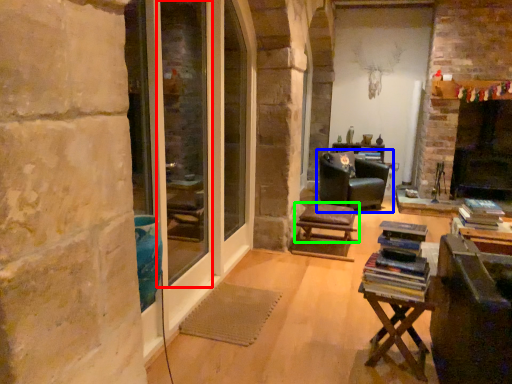
Question: Considering the real-world distances, which object is farthest from screen door (highlighted by a red box)? chair (highlighted by a blue box) or stool (highlighted by a green box)?

Choices:
 (A) chair
 (B) stool

Answer: (A)